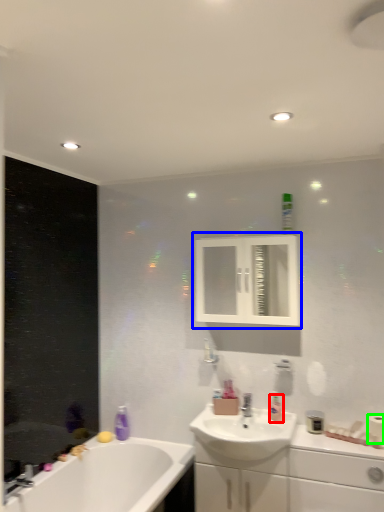
Question: Which is nearer to the toiletry (highlighted by a red box)? medicine cabinet (highlighted by a blue box) or toilet paper (highlighted by a green box).

Choices:
 (A) medicine cabinet
 (B) toilet paper

Answer: (B)